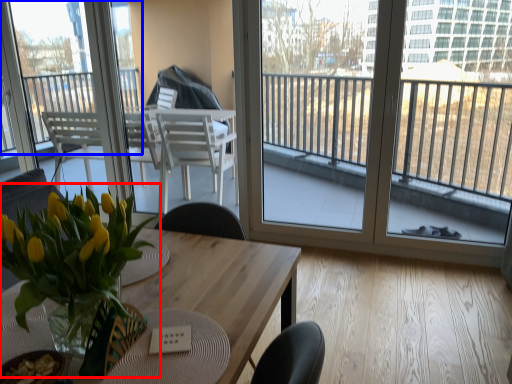
Question: Among these objects, which one is nearest to the camera, houseplant (highlighted by a red box) or window (highlighted by a blue box)?

Choices:
 (A) houseplant
 (B) window

Answer: (A)